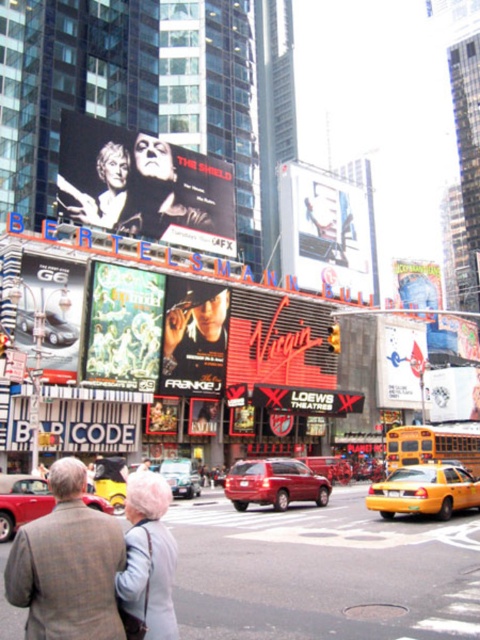
You are a pedestrian in Times Square and want to cross the street safely. You see a gray wool coat at lower left and a yellow rubber taxi at center. Which object is closer to you?

The gray wool coat at lower left is closer to you because it is positioned over the yellow rubber taxi at center, indicating it is in front.